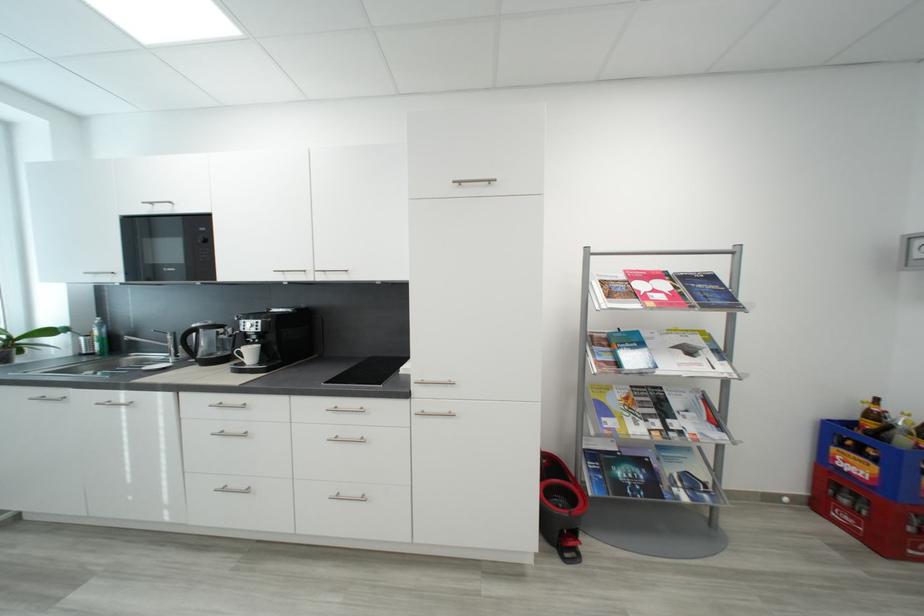
This screenshot has height=616, width=924. What are the coordinates of `faucet handle` in the screenshot? It's located at (142, 352).